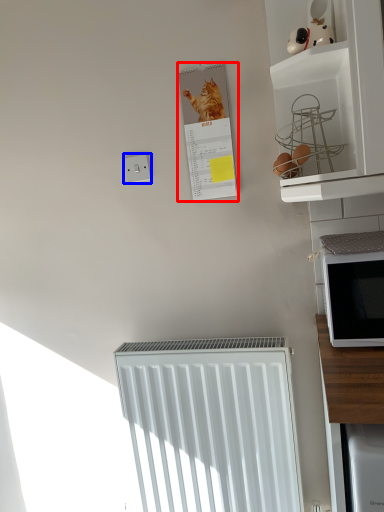
Question: Which of the following is the farthest to the observer, bulletin board (highlighted by a red box) or electric outlet (highlighted by a blue box)?

Choices:
 (A) bulletin board
 (B) electric outlet

Answer: (B)